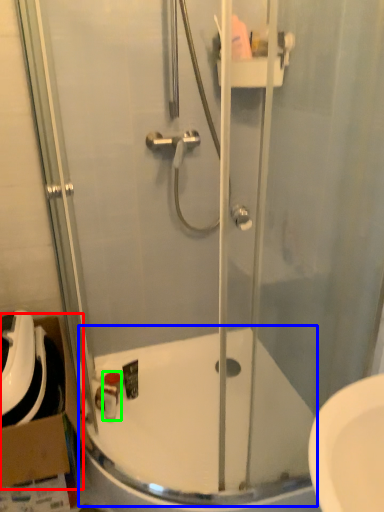
Question: Considering the real-world distances, which object is closest to cardboard box (highlighted by a red box)? bath (highlighted by a blue box) or toiletry (highlighted by a green box).

Choices:
 (A) bath
 (B) toiletry

Answer: (B)